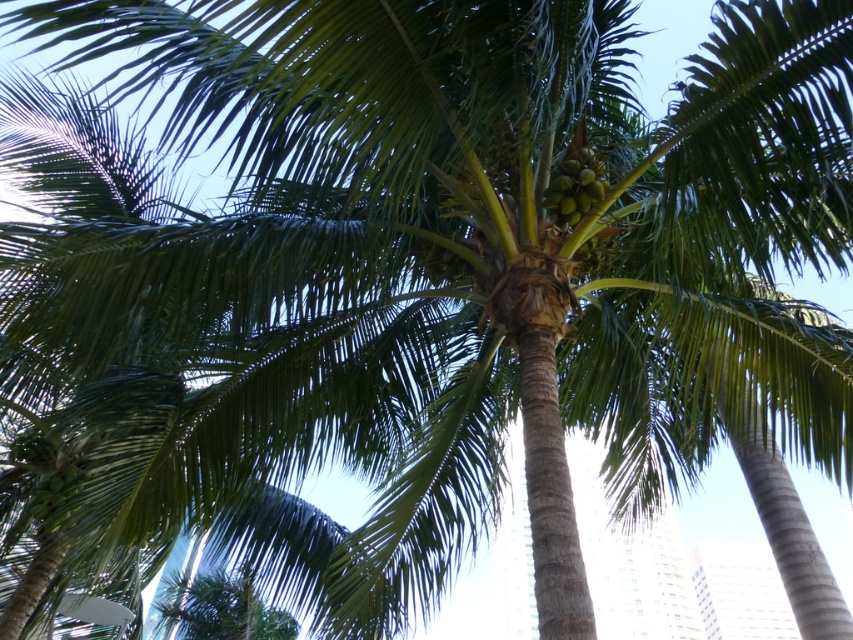
Is green matte coconuts at center smaller than green matte coconuts at lower left?

Yes.

The image size is (853, 640). What do you see at coordinates (575, 186) in the screenshot? I see `green matte coconuts at center` at bounding box center [575, 186].

Where is `green matte coconuts at center`? The image size is (853, 640). green matte coconuts at center is located at coordinates (575, 186).